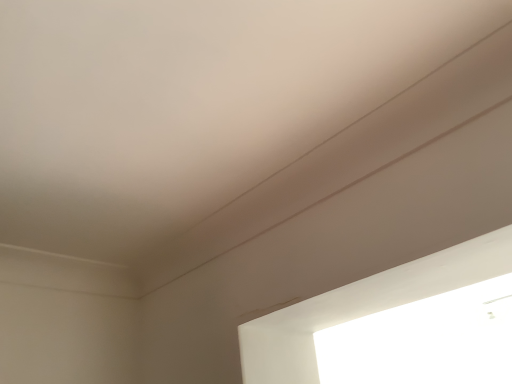
This screenshot has width=512, height=384. What are the coordinates of `white glossy window at lower right` in the screenshot? It's located at (366, 304).

The image size is (512, 384). What do you see at coordinates (366, 304) in the screenshot?
I see `white glossy window at lower right` at bounding box center [366, 304].

This screenshot has width=512, height=384. In order to click on white glossy window at lower right in this screenshot , I will do `click(366, 304)`.